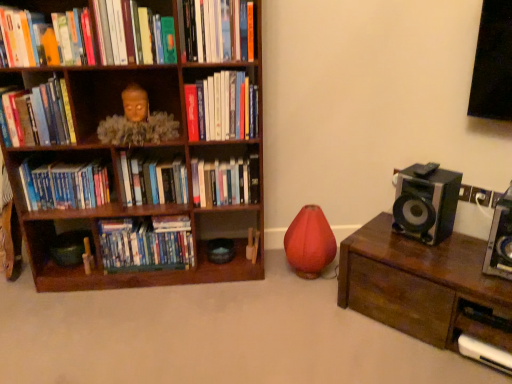
Locate an element on the screen. The width and height of the screenshot is (512, 384). vacant region to the left of matte red vase at center is located at coordinates (267, 267).